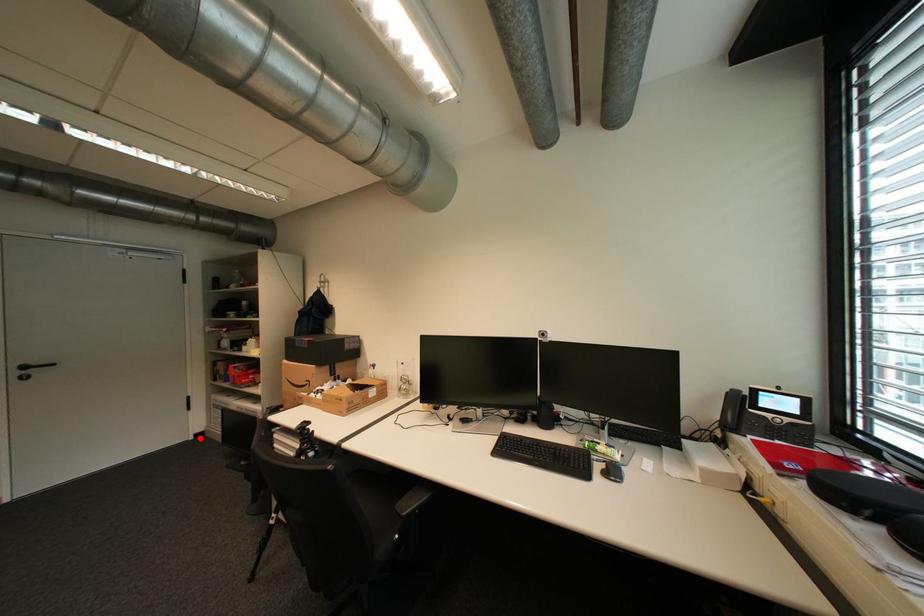
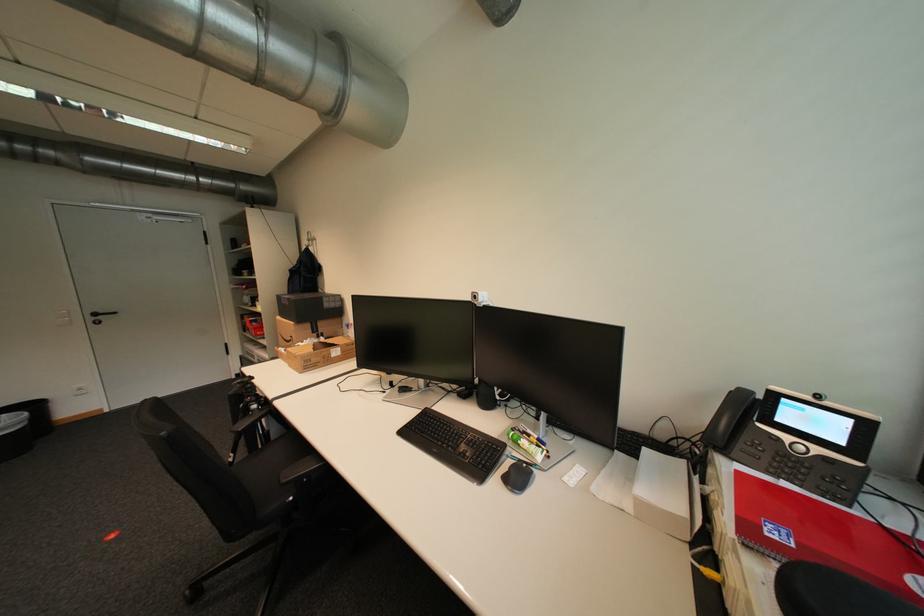
Question: I am providing you with two images of the same scene from different viewpoints. Image1 has a red point marked. In image2, the corresponding 3D location appears at what relative position? Reply with the corresponding letter.

Choices:
 (A) Closer
 (B) Farther

Answer: (B)